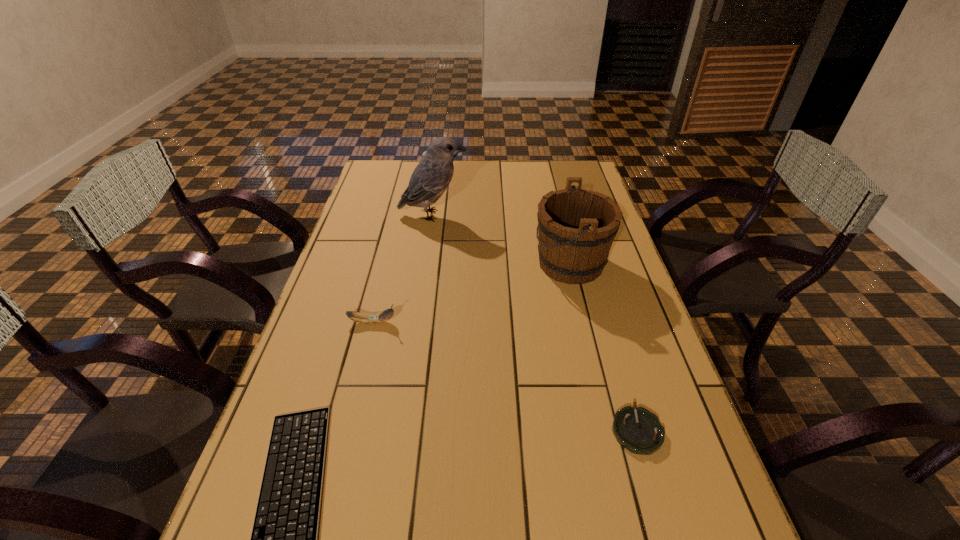
At what (x,y) coordinates should I click in order to perform the action: click on parrot. Please return your answer as a coordinate pair (x, y). Looking at the image, I should click on (431, 177).

At what (x,y) coordinates should I click in order to perform the action: click on the fifth nearest object. Please return your answer as a coordinate pair (x, y). Looking at the image, I should click on click(431, 177).

The height and width of the screenshot is (540, 960). I want to click on the fifth shortest object, so click(x=576, y=228).

Image resolution: width=960 pixels, height=540 pixels. In order to click on wine bucket in this screenshot , I will do pos(576,228).

Locate an element on the screen. The image size is (960, 540). the farthest object is located at coordinates (425, 151).

This screenshot has width=960, height=540. In order to click on the fourth shortest object in this screenshot , I will do `click(425, 151)`.

Find the location of a particular element. the fourth farthest object is located at coordinates (370, 318).

Image resolution: width=960 pixels, height=540 pixels. Identify the location of banana. (370, 318).

Locate an element on the screen. The height and width of the screenshot is (540, 960). the fifth tallest object is located at coordinates (638, 430).

Where is `free spot located 0.160m on the front-facing side of the parrot`? This screenshot has width=960, height=540. free spot located 0.160m on the front-facing side of the parrot is located at coordinates (513, 215).